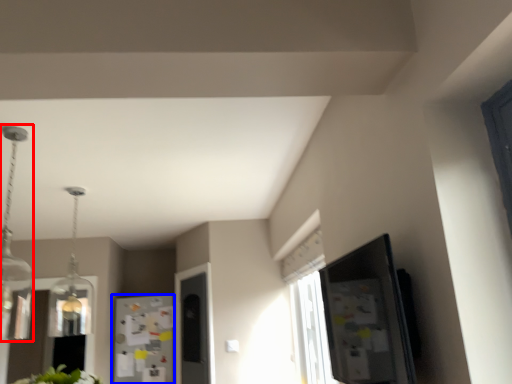
Question: Which object is further to the camera taking this photo, light fixture (highlighted by a red box) or fridge (highlighted by a blue box)?

Choices:
 (A) light fixture
 (B) fridge

Answer: (B)